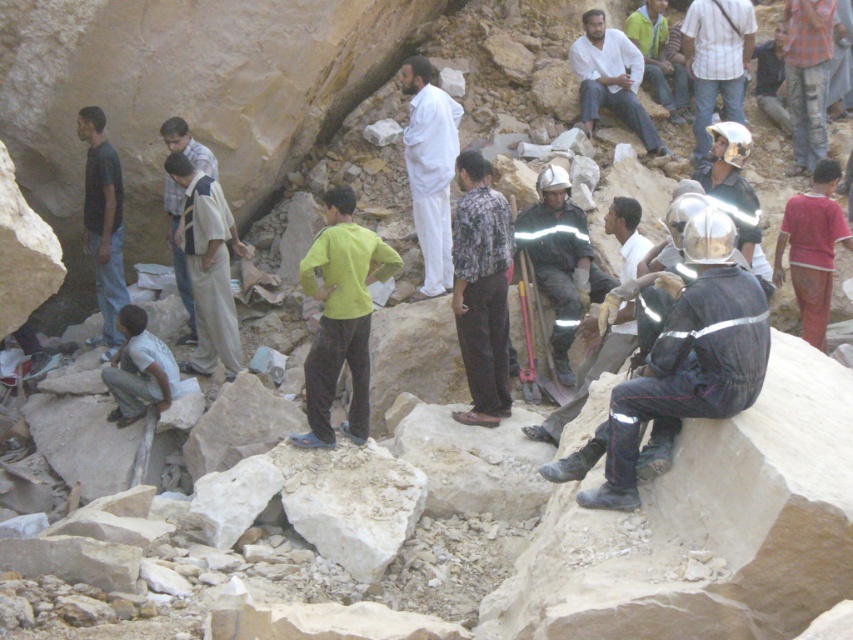
Question: Estimate the real-world distances between objects in this image. Which object is farther from the dark blue shirt at left?

Choices:
 (A) red cotton shirt at right
 (B) white reflective helmet at upper right

Answer: (B)

Question: Which of the following is the farthest from the observer?

Choices:
 (A) black reflective uniform at right
 (B) dark blue shirt at left

Answer: (B)

Question: Can you confirm if white reflective helmet at upper right is positioned above checkered fabric shirt at upper right?

Choices:
 (A) yes
 (B) no

Answer: (A)

Question: Which point appears closest to the camera in this image?

Choices:
 (A) click(109, 241)
 (B) click(405, 163)
 (C) click(552, 216)
 (D) click(822, 88)

Answer: (C)

Question: Observing the image, what is the correct spatial positioning of white reflective helmet at upper right in reference to light gray fabric shirt at lower left?

Choices:
 (A) above
 (B) below

Answer: (A)

Question: Does black reflective uniform at right have a lesser width compared to checkered fabric shirt at upper right?

Choices:
 (A) yes
 (B) no

Answer: (B)